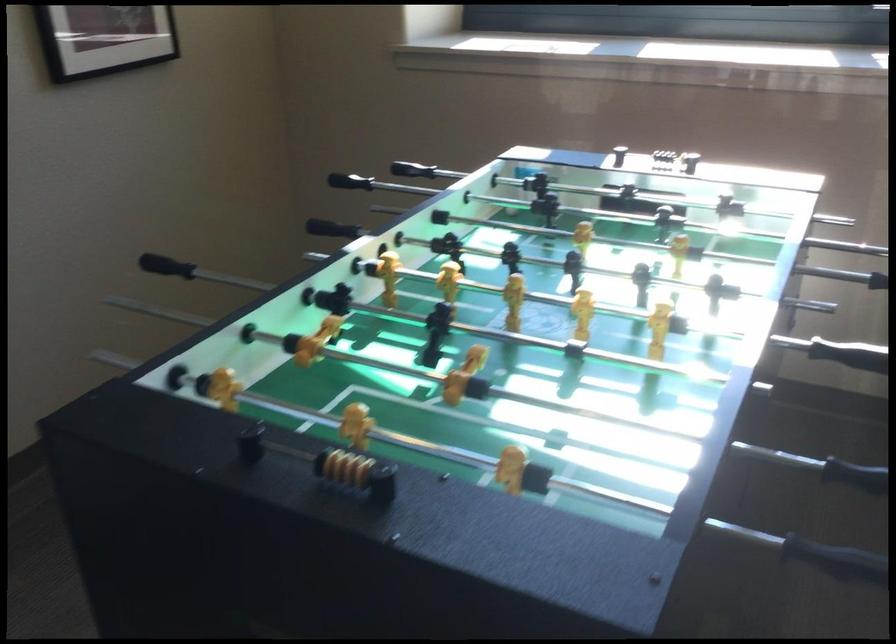
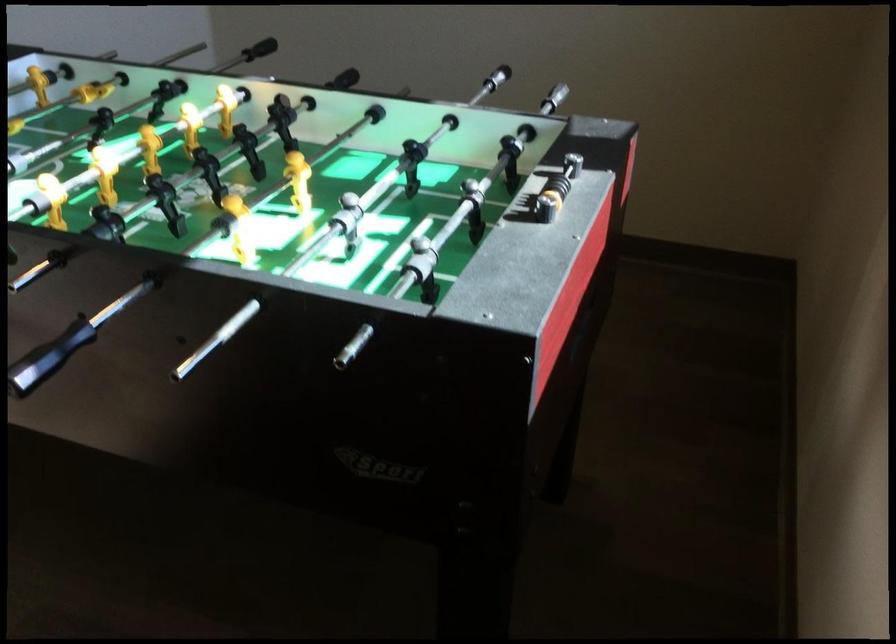
The point at (113, 249) is marked in the first image. Where is the corresponding point in the second image?

(554, 98)